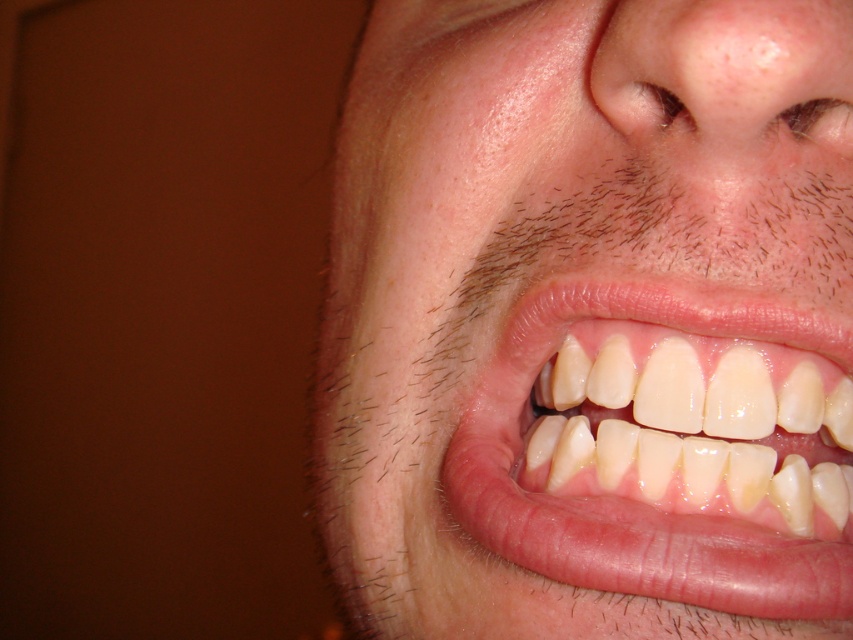
Is smooth skin at center shorter than white glossy teeth at center?

In fact, smooth skin at center may be taller than white glossy teeth at center.

In order to click on smooth skin at center in this screenshot , I will do `click(570, 298)`.

What do you see at coordinates (570, 298) in the screenshot? This screenshot has width=853, height=640. I see `smooth skin at center` at bounding box center [570, 298].

At what (x,y) coordinates should I click in order to perform the action: click on smooth skin at center. Please return your answer as a coordinate pair (x, y). Looking at the image, I should click on (570, 298).